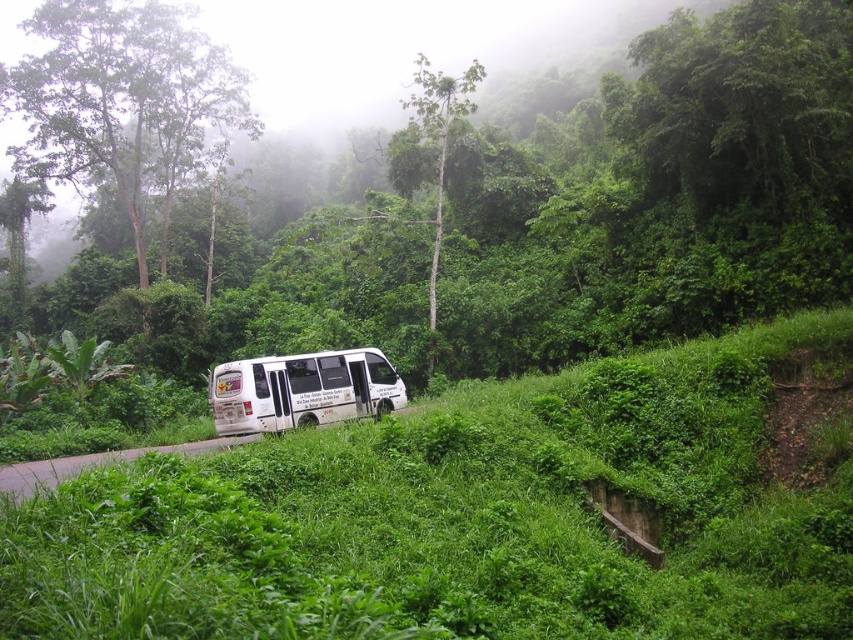
Question: Does green leafy tree at upper left appear over white matte van at center?

Choices:
 (A) no
 (B) yes

Answer: (B)

Question: Considering the real-world distances, which object is farthest from the green leafy tree at upper left?

Choices:
 (A) white matte van at center
 (B) green smooth tree at upper center
 (C) green leafy tree at center

Answer: (A)

Question: Among these objects, which one is farthest from the camera?

Choices:
 (A) green leafy tree at upper left
 (B) white matte van at center

Answer: (A)

Question: Which of the following is the closest to the observer?

Choices:
 (A) green leafy tree at center
 (B) green leafy tree at upper left

Answer: (A)

Question: Can you confirm if green leafy tree at upper left is wider than green smooth tree at upper center?

Choices:
 (A) no
 (B) yes

Answer: (B)

Question: From the image, what is the correct spatial relationship of green leafy tree at upper left in relation to green smooth tree at upper center?

Choices:
 (A) below
 (B) above

Answer: (A)